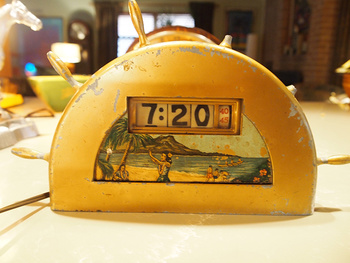
The height and width of the screenshot is (263, 350). I want to click on daylight / white sky through window, so click(x=123, y=25).